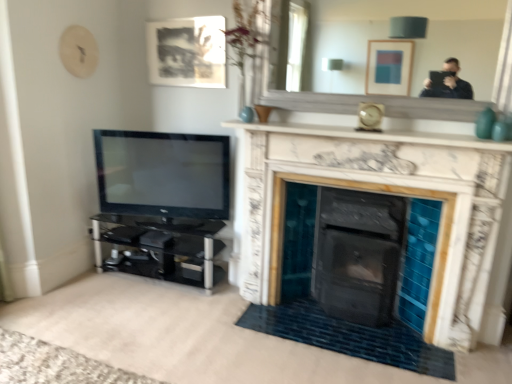
What is the approximate height of matte black picture frame at upper center?

matte black picture frame at upper center is 21.43 inches tall.

What do you see at coordinates (373, 135) in the screenshot? Image resolution: width=512 pixels, height=384 pixels. I see `white marble fireplace at upper center` at bounding box center [373, 135].

Find the location of a particular element. This screenshot has height=384, width=512. white marble fireplace at center is located at coordinates (387, 193).

Image resolution: width=512 pixels, height=384 pixels. In order to click on black glossy tv at left in this screenshot , I will do `click(163, 174)`.

Is white marble fireplace at center not within black glass entertainment center at left?

That's correct, white marble fireplace at center is outside of black glass entertainment center at left.

At what (x,y) coordinates should I click in order to perform the action: click on fireplace above the black glass entertainment center at left (from the image's perspective). Please return your answer as a coordinate pair (x, y). Looking at the image, I should click on pos(387,193).

What's the angular difference between white marble fireplace at center and black glass entertainment center at left's facing directions?

The angular difference between white marble fireplace at center and black glass entertainment center at left is 1.72 degrees.

From a real-world perspective, is white marble fireplace at center beneath black glass entertainment center at left?

Incorrect, from a real-world perspective, white marble fireplace at center is higher than black glass entertainment center at left.

From the image's perspective, is white marble fireplace at upper center above or below white marble mirror at upper center?

Based on their image positions, white marble fireplace at upper center is located beneath white marble mirror at upper center.

Is white marble fireplace at upper center positioned beyond the bounds of white marble mirror at upper center?

That's correct, white marble fireplace at upper center is outside of white marble mirror at upper center.

Is white marble fireplace at upper center turned away from white marble mirror at upper center?

white marble fireplace at upper center does not have its back to white marble mirror at upper center.

How different are the orientations of matte black picture frame at upper center and white marble fireplace at center in degrees?

The angular difference between matte black picture frame at upper center and white marble fireplace at center is 0.623 degrees.

Between matte black picture frame at upper center and white marble fireplace at center, which one is positioned in front?

Positioned in front is white marble fireplace at center.

Is matte black picture frame at upper center smaller than white marble fireplace at center?

Correct, matte black picture frame at upper center occupies less space than white marble fireplace at center.

Which object is positioned more to the left, matte black picture frame at upper center or white marble fireplace at center?

matte black picture frame at upper center.

In the image, is white marble fireplace at center positioned in front of or behind matte black picture frame at upper center?

white marble fireplace at center is positioned closer to the viewer than matte black picture frame at upper center.

Is white marble fireplace at center oriented away from matte black picture frame at upper center?

No, white marble fireplace at center's orientation is not away from matte black picture frame at upper center.

Which is more distant, [338,161] or [220,52]?

The point [220,52] is more distant.

Is white marble fireplace at center beside matte black picture frame at upper center?

No, white marble fireplace at center is not making contact with matte black picture frame at upper center.

From the image's perspective, is black glass entertainment center at left located above or below white marble fireplace at upper center?

Based on their image positions, black glass entertainment center at left is located beneath white marble fireplace at upper center.

Is black glass entertainment center at left looking in the opposite direction of white marble fireplace at upper center?

black glass entertainment center at left is not turned away from white marble fireplace at upper center.

From the picture: Which object is further away from the camera, black glass entertainment center at left or white marble fireplace at upper center?

black glass entertainment center at left is further from the camera.

Which is behind, point (216, 230) or point (315, 132)?

The point (216, 230) is farther.

Can you confirm if white marble fireplace at upper center is thinner than matte black picture frame at upper center?

No, white marble fireplace at upper center is not thinner than matte black picture frame at upper center.

Looking at this image, which object is positioned more to the left, white marble fireplace at upper center or matte black picture frame at upper center?

matte black picture frame at upper center is more to the left.

Is matte black picture frame at upper center inside white marble fireplace at upper center?

Actually, matte black picture frame at upper center is outside white marble fireplace at upper center.

This screenshot has height=384, width=512. I want to click on mantle below the white marble mirror at upper center (from a real-world perspective), so 373,135.

In terms of size, does white marble mirror at upper center appear bigger or smaller than white marble fireplace at upper center?

Considering their sizes, white marble mirror at upper center takes up more space than white marble fireplace at upper center.

Is point (289, 103) closer or farther from the camera than point (334, 127)?

Point (289, 103) is positioned farther from the camera compared to point (334, 127).

From the image's perspective, is white marble mirror at upper center above or below white marble fireplace at upper center?

white marble mirror at upper center is situated higher than white marble fireplace at upper center in the image.

Where is `fireplace in front of the black glass entertainment center at left`? fireplace in front of the black glass entertainment center at left is located at coordinates (387, 193).

I want to click on mirror located above the white marble fireplace at upper center (from a real-world perspective), so click(x=412, y=74).

Estimate the real-world distances between objects in this image. Which object is closer to matte black picture frame at upper center, white marble mirror at upper center or white marble fireplace at upper center?

Among the two, white marble fireplace at upper center is located nearer to matte black picture frame at upper center.

Estimate the real-world distances between objects in this image. Which object is further from white marble fireplace at upper center, matte black picture frame at upper center or black glass entertainment center at left?

black glass entertainment center at left.

Considering their positions, is black glossy tv at left positioned closer to white marble fireplace at center than matte black picture frame at upper center?

black glossy tv at left.

Based on their spatial positions, is white marble fireplace at upper center or matte black picture frame at upper center closer to black glossy tv at left?

white marble fireplace at upper center lies closer to black glossy tv at left than the other object.

From the image, which object appears to be farther from white marble mirror at upper center, white marble fireplace at upper center or matte black picture frame at upper center?

white marble fireplace at upper center lies further to white marble mirror at upper center than the other object.

When comparing their distances from white marble fireplace at upper center, does black glass entertainment center at left or white marble fireplace at center seem closer?

Among the two, white marble fireplace at center is located nearer to white marble fireplace at upper center.

Looking at the image, which one is located further to white marble fireplace at center, black glass entertainment center at left or white marble mirror at upper center?

The object further to white marble fireplace at center is white marble mirror at upper center.

Considering their positions, is black glossy tv at left positioned closer to white marble fireplace at upper center than white marble mirror at upper center?

black glossy tv at left is positioned closer to the anchor white marble fireplace at upper center.

What are the coordinates of `fireplace between black glossy tv at left and white marble mirror at upper center in the horizontal direction` in the screenshot? It's located at (387, 193).

In order to click on mantle between white marble mirror at upper center and white marble fireplace at center in the vertical direction in this screenshot , I will do `click(373, 135)`.

Identify the location of mantle situated between matte black picture frame at upper center and white marble mirror at upper center from left to right. The image size is (512, 384). (373, 135).

Locate an element on the screen. fireplace between matte black picture frame at upper center and black glass entertainment center at left vertically is located at coordinates (387, 193).